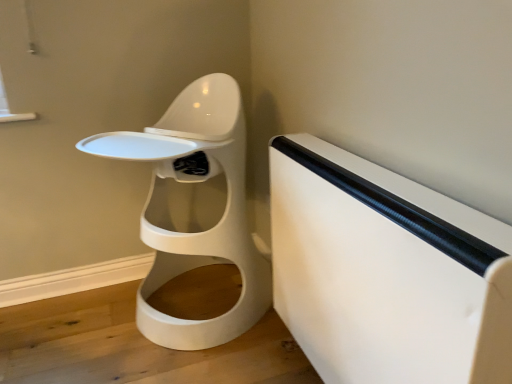
Question: From a real-world perspective, relative to white matte toilet at center, is white matte changing table at right vertically above or below?

Choices:
 (A) above
 (B) below

Answer: (B)

Question: Is white matte changing table at right to the left or to the right of white matte toilet at center in the image?

Choices:
 (A) left
 (B) right

Answer: (B)

Question: Looking at the image, does white matte changing table at right seem bigger or smaller compared to white matte toilet at center?

Choices:
 (A) small
 (B) big

Answer: (A)

Question: In the image, is white matte toilet at center positioned in front of or behind white matte changing table at right?

Choices:
 (A) front
 (B) behind

Answer: (B)

Question: Based on their sizes in the image, would you say white matte toilet at center is bigger or smaller than white matte changing table at right?

Choices:
 (A) big
 (B) small

Answer: (A)

Question: Looking at their shapes, would you say white matte toilet at center is wider or thinner than white matte changing table at right?

Choices:
 (A) wide
 (B) thin

Answer: (A)

Question: From their relative heights in the image, would you say white matte toilet at center is taller or shorter than white matte changing table at right?

Choices:
 (A) short
 (B) tall

Answer: (B)